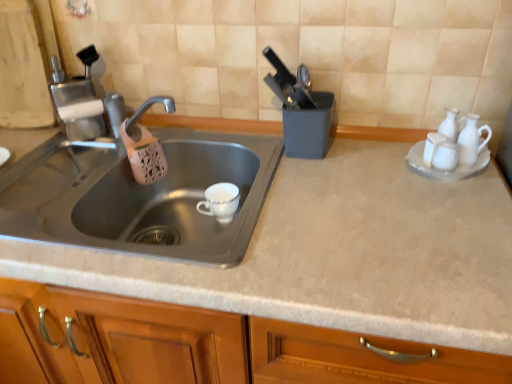
You are a GUI agent. You are given a task and a screenshot of the screen. Output one action in this format:
    pyautogui.click(x=<x>, y=<y>)
    Task: Click on the vacant region above matte gray countertop at center (from a real-world perspective)
    This screenshot has width=512, height=384.
    Given the screenshot: What is the action you would take?
    (305, 218)